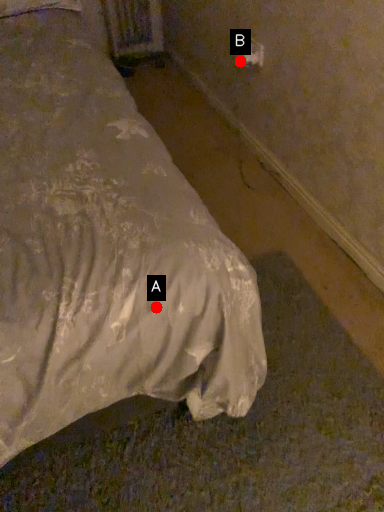
Question: Two points are circled on the image, labeled by A and B beside each circle. Among these points, which one is nearest to the camera?

Choices:
 (A) A is closer
 (B) B is closer

Answer: (A)